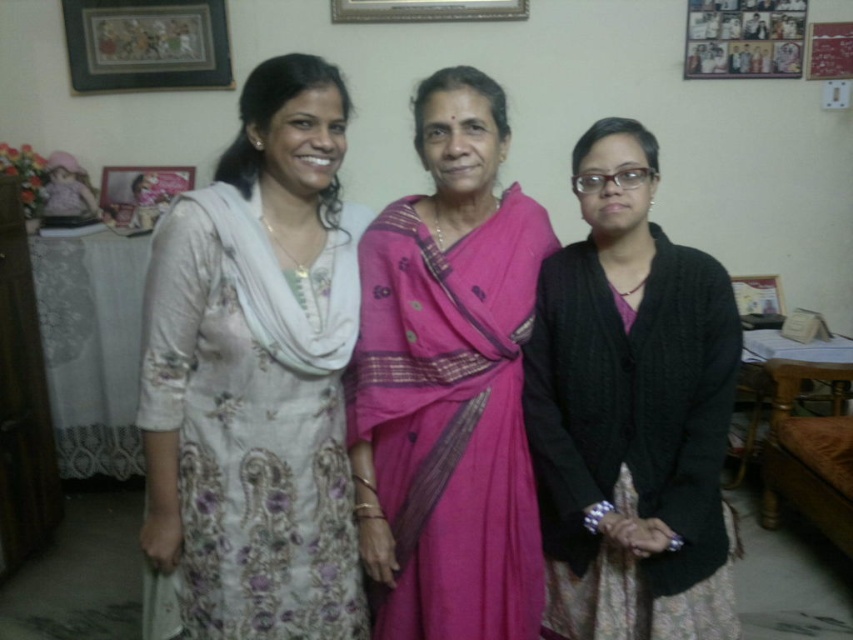
Question: Where is pink silk saree at center located in relation to matte wooden picture frame at upper left in the image?

Choices:
 (A) right
 (B) left

Answer: (A)

Question: Does black knitted cardigan at center have a larger size compared to wooden photo frame at upper right?

Choices:
 (A) no
 (B) yes

Answer: (B)

Question: Is pink silk saree at center thinner than black knitted cardigan at center?

Choices:
 (A) no
 (B) yes

Answer: (B)

Question: Which point is closer to the camera?

Choices:
 (A) (125, 16)
 (B) (727, 40)
 (C) (206, 305)
 (D) (752, 307)

Answer: (C)

Question: Which point is closer to the camera taking this photo?

Choices:
 (A) (422, 237)
 (B) (218, 618)
 (C) (740, 280)
 (D) (619, 388)

Answer: (B)

Question: Estimate the real-world distances between objects in this image. Which object is closer to the matte floral dress at center?

Choices:
 (A) wooden picture frame at upper left
 (B) wooden picture frame at upper right

Answer: (A)